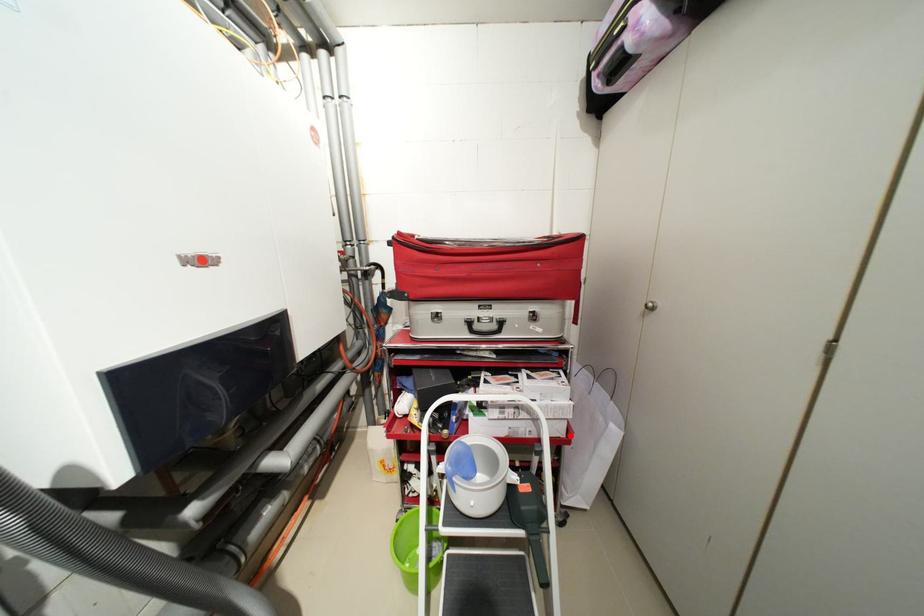
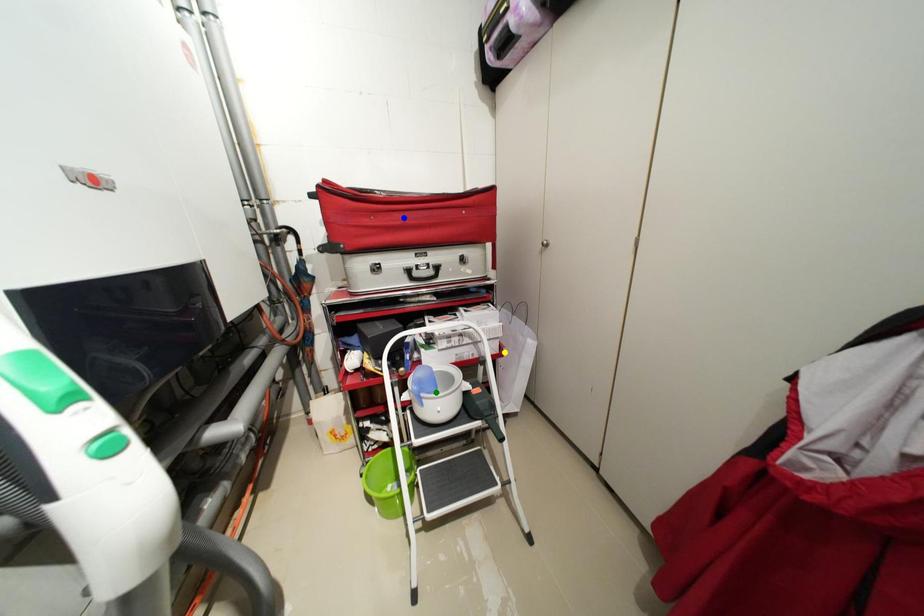
Question: I am providing you with two images of the same scene from different viewpoints. A red point is marked on the first image. You are given multiple points on the second image. Can you choose the point in image 2 that corresponds to the point in image 1?

Choices:
 (A) yellow point
 (B) green point
 (C) blue point

Answer: (A)